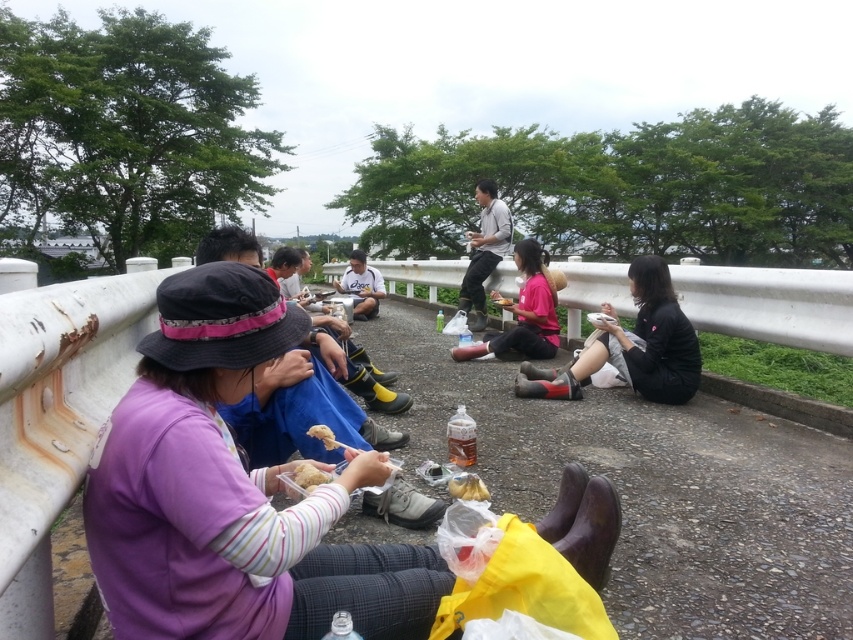
Does black matte sneakers at lower right have a greater width compared to yellow matte plate at center?

Correct, the width of black matte sneakers at lower right exceeds that of yellow matte plate at center.

Can you confirm if black matte sneakers at lower right is positioned below yellow matte plate at center?

Yes, black matte sneakers at lower right is below yellow matte plate at center.

Between point (619, 365) and point (505, 298), which one is positioned behind?

The point (505, 298) is behind.

The height and width of the screenshot is (640, 853). I want to click on black matte sneakers at lower right, so click(x=631, y=348).

Describe the element at coordinates (631, 348) in the screenshot. I see `black matte sneakers at lower right` at that location.

Locate an element on the screen. This screenshot has height=640, width=853. black matte sneakers at lower right is located at coordinates (631, 348).

This screenshot has width=853, height=640. I want to click on black matte sneakers at lower right, so click(631, 348).

Is point (558, 396) farther from camera compared to point (467, 268)?

No, (558, 396) is closer to viewer.

You are a GUI agent. You are given a task and a screenshot of the screen. Output one action in this format:
    pyautogui.click(x=<x>, y=<y>)
    Task: Click on the black matte sneakers at lower right
    The width and height of the screenshot is (853, 640).
    Given the screenshot: What is the action you would take?
    pyautogui.click(x=631, y=348)